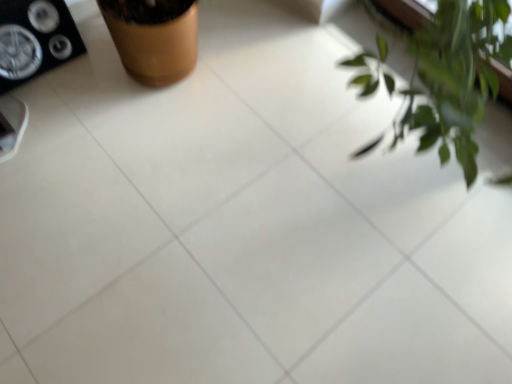
What are the coordinates of `vacant space to the right of metallic silver speaker at upper left` in the screenshot? It's located at (92, 77).